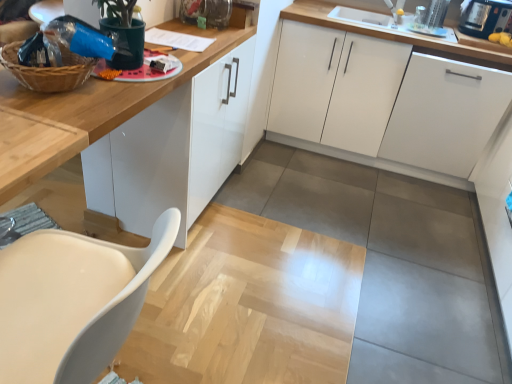
At what (x,y) coordinates should I click in order to perform the action: click on vacant space in front of white glossy cabinet at upper center, the 3th cabinetry when ordered from right to left. Please return your answer as a coordinate pair (x, y). Looking at the image, I should click on (218, 277).